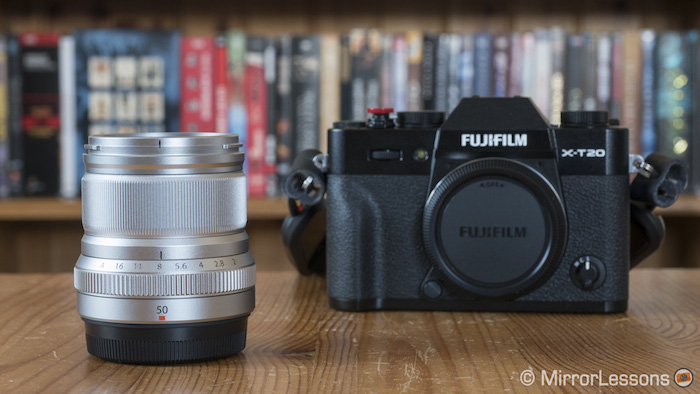
Identify the location of back of shelf. (318, 17).